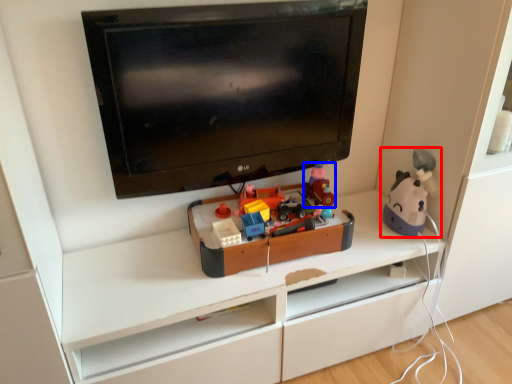
Question: Which of the following is the farthest to the observer, toy (highlighted by a red box) or toy (highlighted by a blue box)?

Choices:
 (A) toy
 (B) toy

Answer: (B)